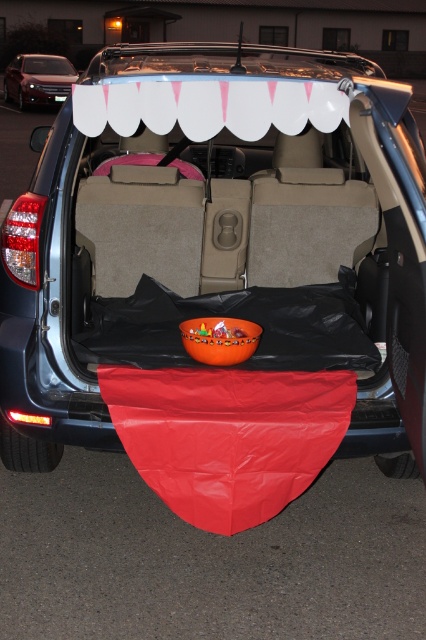
You are a delivery person who needs to place a large package in the SUV. The package is 2 meters long. Can you fit the package between the red matte blanket at lower center and the satin silver sedan at upper left?

The distance between the red matte blanket at lower center and the satin silver sedan at upper left is 21.72 meters, which is more than enough to accommodate the 2 meter long package. Yes, the package can be placed between them.

You are standing in front of the open rear hatch of the dark SUV. You want to place a gift box on the red matte blanket at lower center. Where exactly should you place it?

The red matte blanket at lower center is located at point (227, 435), so you should place the gift box there.